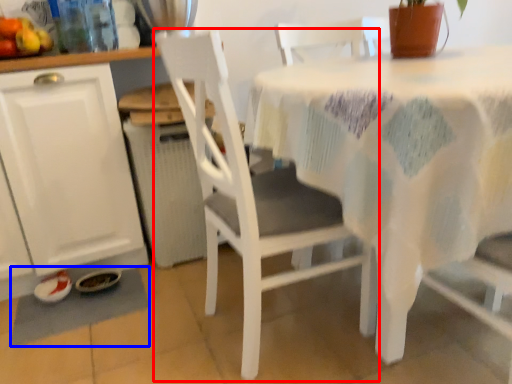
Question: Which object appears closest to the camera in this image, chair (highlighted by a red box) or place mat (highlighted by a blue box)?

Choices:
 (A) chair
 (B) place mat

Answer: (A)